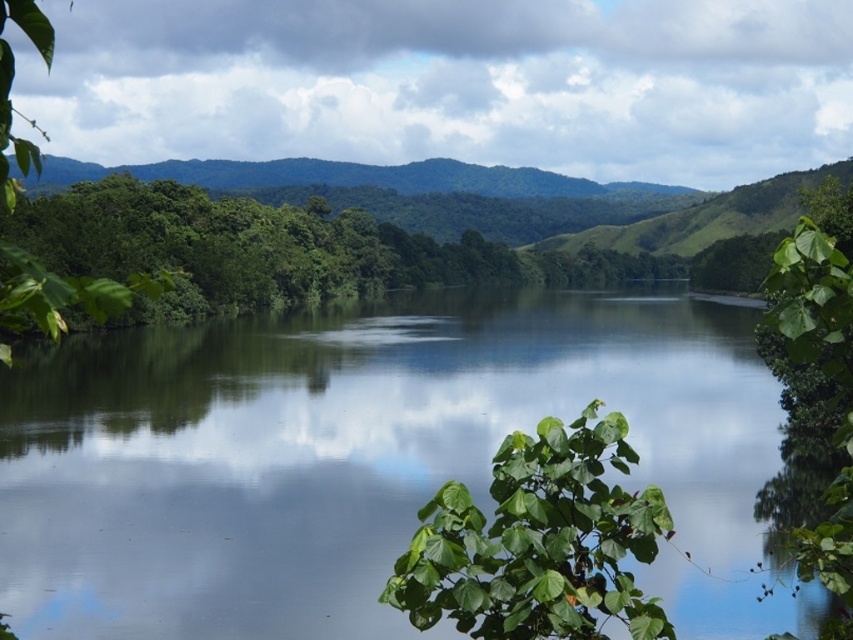
Does green reflective water at center have a lesser height compared to green leafy plant at center?

No.

Is the position of green reflective water at center more distant than that of green leafy plant at center?

Yes, it is.

Is point (79, 493) positioned behind point (548, 465)?

Yes, point (79, 493) is farther from viewer.

Image resolution: width=853 pixels, height=640 pixels. What are the coordinates of `green reflective water at center` in the screenshot? It's located at (376, 460).